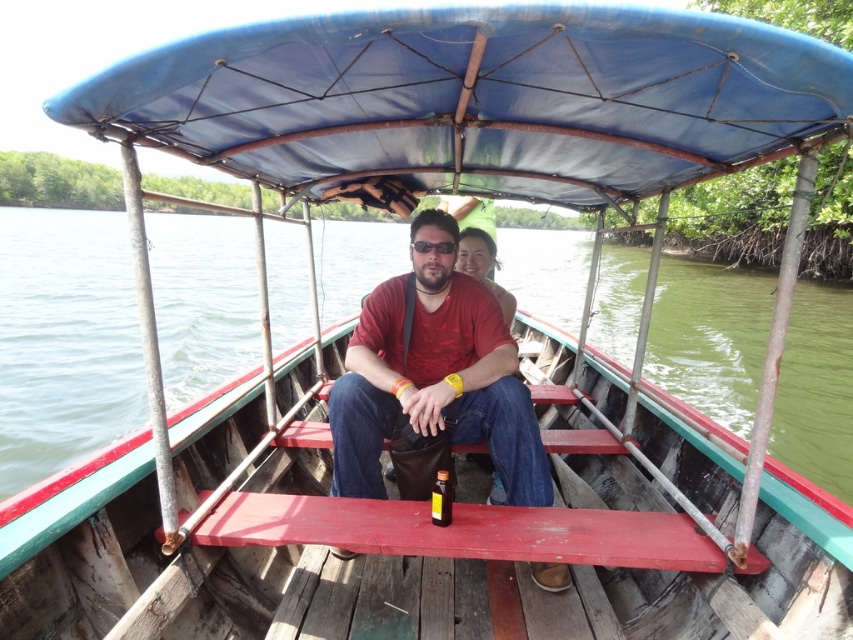
Is green water at boat center thinner than translucent amber bottle at center?

No, green water at boat center is not thinner than translucent amber bottle at center.

Can you confirm if green water at boat center is smaller than translucent amber bottle at center?

Actually, green water at boat center might be larger than translucent amber bottle at center.

Where is `green water at boat center`? This screenshot has height=640, width=853. green water at boat center is located at coordinates (64, 339).

Between matte red shirt at center and translucent amber bottle at center, which one has more height?

Standing taller between the two is matte red shirt at center.

Can you confirm if matte red shirt at center is shorter than translucent amber bottle at center?

No, matte red shirt at center is not shorter than translucent amber bottle at center.

This screenshot has height=640, width=853. Find the location of `matte red shirt at center`. matte red shirt at center is located at coordinates (434, 374).

From the picture: Is blue fabric canopy at center bigger than translucent amber bottle at center?

Yes, blue fabric canopy at center is bigger than translucent amber bottle at center.

Which is in front, point (605, 100) or point (445, 476)?

Positioned in front is point (605, 100).

Find the location of a particular element. blue fabric canopy at center is located at coordinates (476, 99).